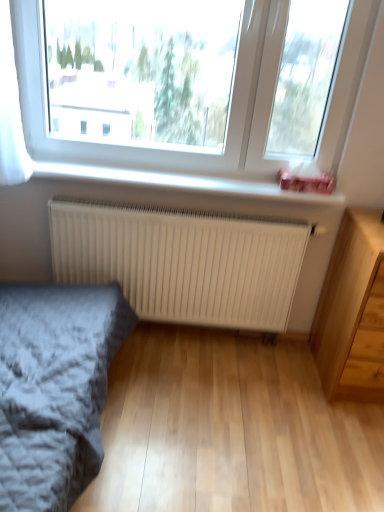
Question: From the image's perspective, is white plastic window sill at upper center below light wood chest of drawers at lower right?

Choices:
 (A) no
 (B) yes

Answer: (A)

Question: Can we say white plastic window sill at upper center lies outside light wood chest of drawers at lower right?

Choices:
 (A) yes
 (B) no

Answer: (A)

Question: Is white plastic window sill at upper center oriented away from light wood chest of drawers at lower right?

Choices:
 (A) no
 (B) yes

Answer: (A)

Question: Does white plastic window sill at upper center lie in front of light wood chest of drawers at lower right?

Choices:
 (A) yes
 (B) no

Answer: (B)

Question: Considering the relative sizes of white plastic window sill at upper center and light wood chest of drawers at lower right in the image provided, is white plastic window sill at upper center shorter than light wood chest of drawers at lower right?

Choices:
 (A) yes
 (B) no

Answer: (A)

Question: Considering their positions, is transparent glass window at upper center located in front of or behind white plastic window sill at upper center?

Choices:
 (A) behind
 (B) front

Answer: (B)

Question: Considering the relative positions of transparent glass window at upper center and white plastic window sill at upper center in the image provided, is transparent glass window at upper center to the left or to the right of white plastic window sill at upper center?

Choices:
 (A) left
 (B) right

Answer: (B)

Question: Is transparent glass window at upper center wider or thinner than white plastic window sill at upper center?

Choices:
 (A) wide
 (B) thin

Answer: (B)

Question: From the image's perspective, is transparent glass window at upper center positioned above or below white plastic window sill at upper center?

Choices:
 (A) above
 (B) below

Answer: (A)

Question: Is gray textured bed at lower left to the left or to the right of white matte radiator at center in the image?

Choices:
 (A) left
 (B) right

Answer: (A)

Question: From their relative heights in the image, would you say gray textured bed at lower left is taller or shorter than white matte radiator at center?

Choices:
 (A) tall
 (B) short

Answer: (A)

Question: From the image's perspective, is gray textured bed at lower left positioned above or below white matte radiator at center?

Choices:
 (A) below
 (B) above

Answer: (A)

Question: In terms of width, does gray textured bed at lower left look wider or thinner when compared to white matte radiator at center?

Choices:
 (A) wide
 (B) thin

Answer: (A)

Question: Does point (258, 30) appear closer or farther from the camera than point (178, 257)?

Choices:
 (A) farther
 (B) closer

Answer: (B)

Question: In terms of height, does transparent glass window at upper center look taller or shorter compared to white matte radiator at center?

Choices:
 (A) short
 (B) tall

Answer: (B)